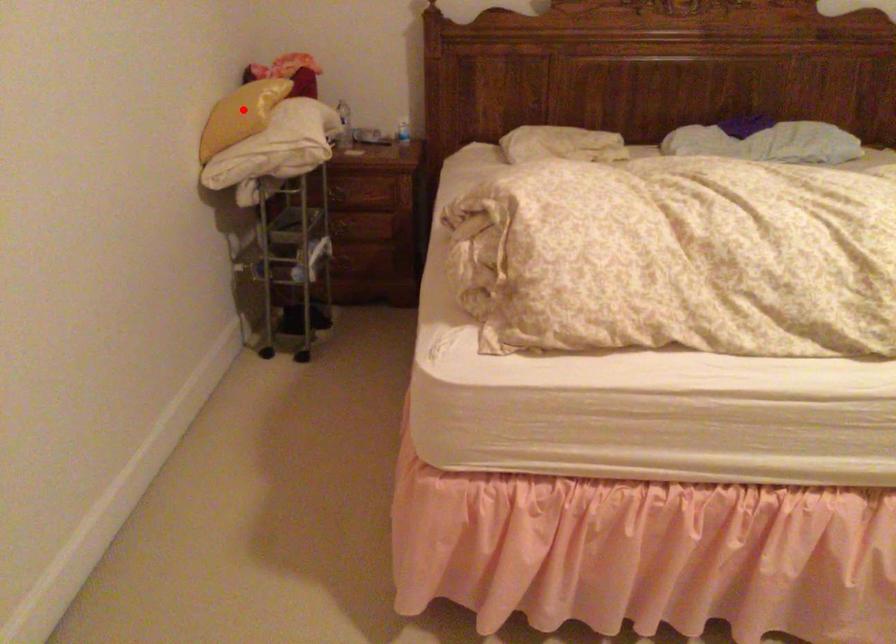
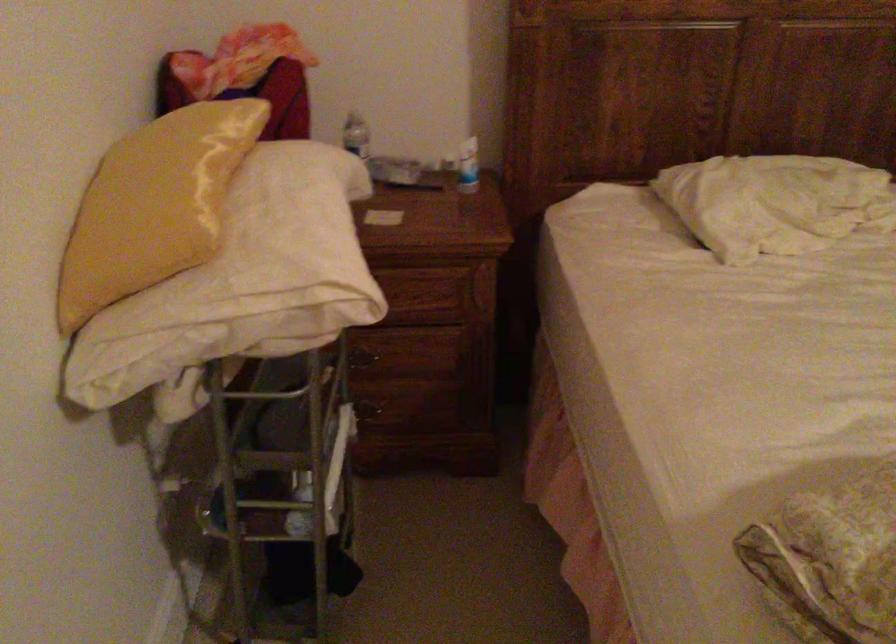
Question: I am providing you with two images of the same scene from different viewpoints. A red point is shown in image1. For the corresponding object point in image2, is it positioned nearer or farther from the camera?

Choices:
 (A) Nearer
 (B) Farther

Answer: (A)